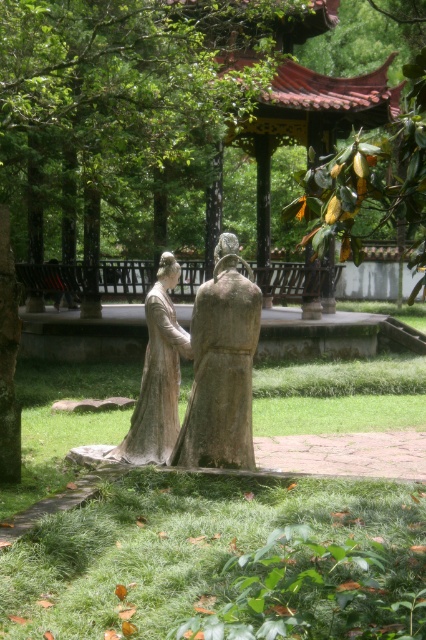
You are standing in the middle of the scene and want to place a new decorative item exactly where the matte stone statues at center are currently located. According to the coordinates provided, where should you place the item in terms of horizontal and vertical positioning?

The matte stone statues at center are located at coordinates point (213, 362). To place the new decorative item exactly there, position it at 56.7 percent horizontally from the left edge and 50 percent vertically from the bottom edge of the scene.